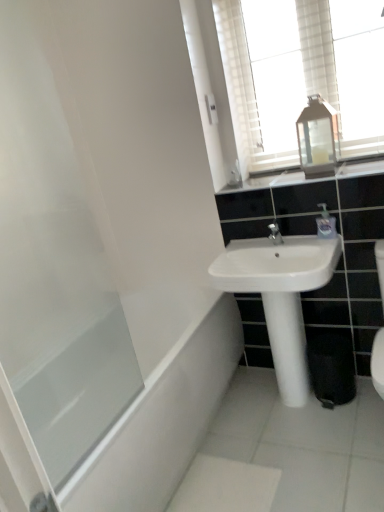
Question: Should I look upward or downward to see white ceramic sink at center?

Choices:
 (A) up
 (B) down

Answer: (B)

Question: Is transparent glass bathtub at lower left to the right of clear glass lantern at upper right from the viewer's perspective?

Choices:
 (A) no
 (B) yes

Answer: (A)

Question: Could you tell me if transparent glass bathtub at lower left is turned towards clear glass lantern at upper right?

Choices:
 (A) yes
 (B) no

Answer: (B)

Question: From the image's perspective, is transparent glass bathtub at lower left under clear glass lantern at upper right?

Choices:
 (A) yes
 (B) no

Answer: (A)

Question: Is transparent glass bathtub at lower left behind clear glass lantern at upper right?

Choices:
 (A) yes
 (B) no

Answer: (B)

Question: Is transparent glass bathtub at lower left not close to clear glass lantern at upper right?

Choices:
 (A) yes
 (B) no

Answer: (A)

Question: From the image's perspective, is transparent glass bathtub at lower left located above clear glass lantern at upper right?

Choices:
 (A) yes
 (B) no

Answer: (B)

Question: From the image's perspective, is transparent glass lantern at upper center on top of white ceramic sink at center?

Choices:
 (A) no
 (B) yes

Answer: (B)

Question: Could you tell me if transparent glass lantern at upper center is facing white ceramic sink at center?

Choices:
 (A) yes
 (B) no

Answer: (B)

Question: Would you say transparent glass lantern at upper center is outside white ceramic sink at center?

Choices:
 (A) yes
 (B) no

Answer: (A)

Question: Is transparent glass lantern at upper center wider than white ceramic sink at center?

Choices:
 (A) yes
 (B) no

Answer: (B)

Question: Is white ceramic sink at center at the back of transparent glass lantern at upper center?

Choices:
 (A) no
 (B) yes

Answer: (A)

Question: Can you confirm if transparent glass lantern at upper center is shorter than white ceramic sink at center?

Choices:
 (A) yes
 (B) no

Answer: (B)

Question: Can you confirm if transparent glass screen door at left is bigger than white ceramic sink at center?

Choices:
 (A) no
 (B) yes

Answer: (B)